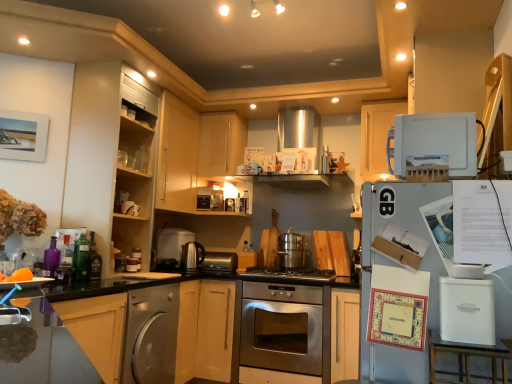
You are a GUI agent. You are given a task and a screenshot of the screen. Output one action in this format:
    pyautogui.click(x=<x>, y=<y>)
    Task: Click on the free spot above white matte water dispenser at right, the 1th appliance from the front (from a real-world perspective)
    This screenshot has height=384, width=512.
    Given the screenshot: What is the action you would take?
    pyautogui.click(x=465, y=279)